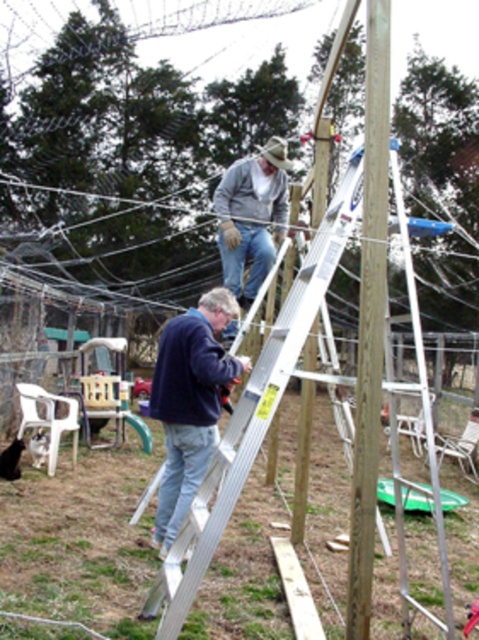
You are a painter standing in the garden and need to paint the brown wood telegraph pole at center. You have a ladder but want to ensure you can reach it without climbing higher than the gray woolen sweater at upper center. Can you determine if the pole is within your reach?

The brown wood telegraph pole at center is located below the gray woolen sweater at upper center, so if the painter can reach up to the level of the gray woolen sweater at upper center, they should be able to paint the pole without needing to climb higher.

Looking at this image, you are a delivery drone that needs to fly through the space between the brown wood telegraph pole at center and the navy blue sweater at center. Can you safely pass through this gap?

The brown wood telegraph pole at center is located above the navy blue sweater at center, so the vertical gap between them allows the drone to safely pass through.

You are standing at the origin point in the scene. The silver metallic ladder at upper center is at coordinates 0.644 on the x axis and 0.530 on the y axis. If you want to move towards the ladder, which direction should you move in terms of x and y coordinates?

To move towards the silver metallic ladder at upper center located at coordinates x 0.644 and y 0.530, you should move in the positive x and positive y direction since the ladder is positioned at higher x and y coordinates compared to the origin.